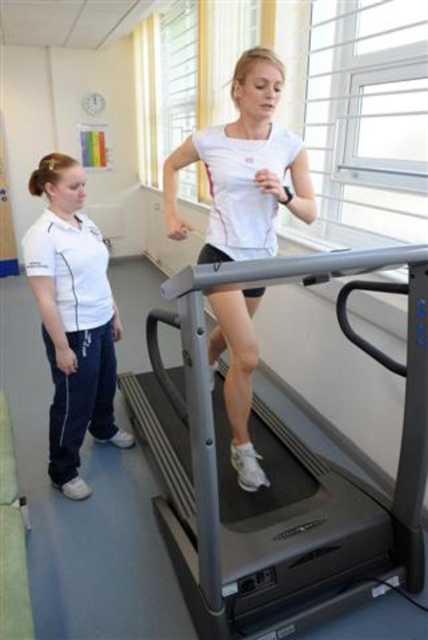
From the picture: You are a fitness trainer planning to place a new elliptical machine in the room. The elliptical requires a space wider than the gray metallic treadmill at center. Can the space currently occupied by the white cotton shirt at left accommodate the elliptical machine?

The gray metallic treadmill at center is wider than the white cotton shirt at left. Since the elliptical machine requires a space wider than the treadmill, the space occupied by the white cotton shirt at left is not wide enough to accommodate the elliptical machine.

You are a fitness instructor in the room. You need to place a 1.5 meter long exercise mat between the gray metallic treadmill at center and the white matte running shoe at center. Is there enough space between them for the mat?

The gray metallic treadmill at center is bigger than the white matte running shoe at center, but the description does not provide specific measurements of the distance between them. Therefore, it is unclear if there is enough space for the 1.5 meter long exercise mat.

You are a fitness trainer who needs to place a 24 inch dumbbell rack between the white matte running shoe at center and the white cotton shirt at left. Can you fit it there?

The distance between the white matte running shoe at center and the white cotton shirt at left is 26.89 inches, so yes, the 24 inch dumbbell rack can fit in that space.